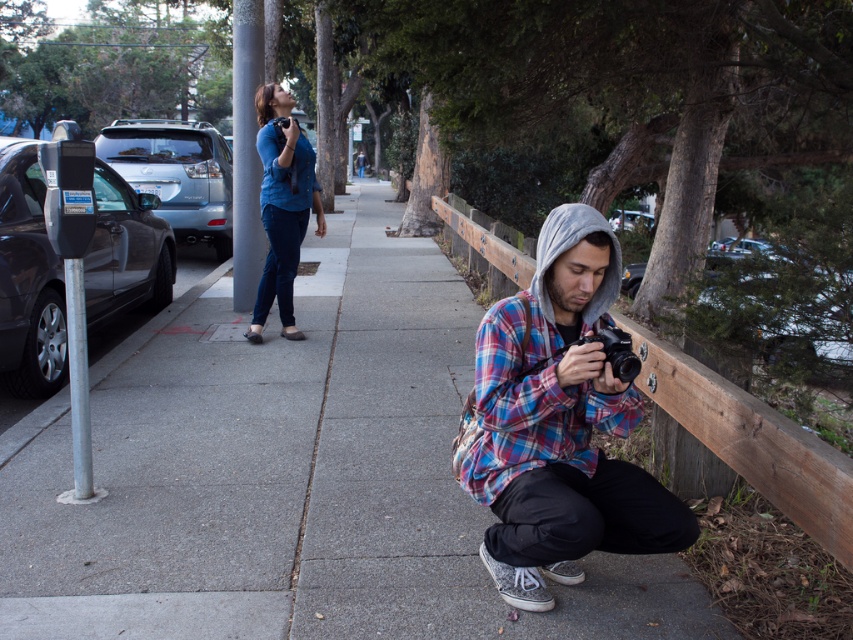
Question: Which object is positioned farthest from the matte blue shirt at center?

Choices:
 (A) plaid flannel shirt at lower right
 (B) matte black camera at lower center

Answer: (B)

Question: Which object is the closest to the plaid flannel shirt at center?

Choices:
 (A) matte blue shirt at center
 (B) matte black camera at lower center

Answer: (B)

Question: Considering the relative positions of gray concrete pavement at center and plaid flannel shirt at lower right in the image provided, where is gray concrete pavement at center located with respect to plaid flannel shirt at lower right?

Choices:
 (A) right
 (B) left

Answer: (B)

Question: Is gray concrete pavement at center positioned before matte black camera at lower center?

Choices:
 (A) no
 (B) yes

Answer: (A)

Question: Which is nearer to the plaid flannel shirt at center?

Choices:
 (A) matte blue shirt at center
 (B) plaid flannel shirt at lower right
 (C) matte black camera at lower center

Answer: (B)

Question: Does matte blue shirt at center appear on the right side of matte black camera at lower center?

Choices:
 (A) no
 (B) yes

Answer: (A)